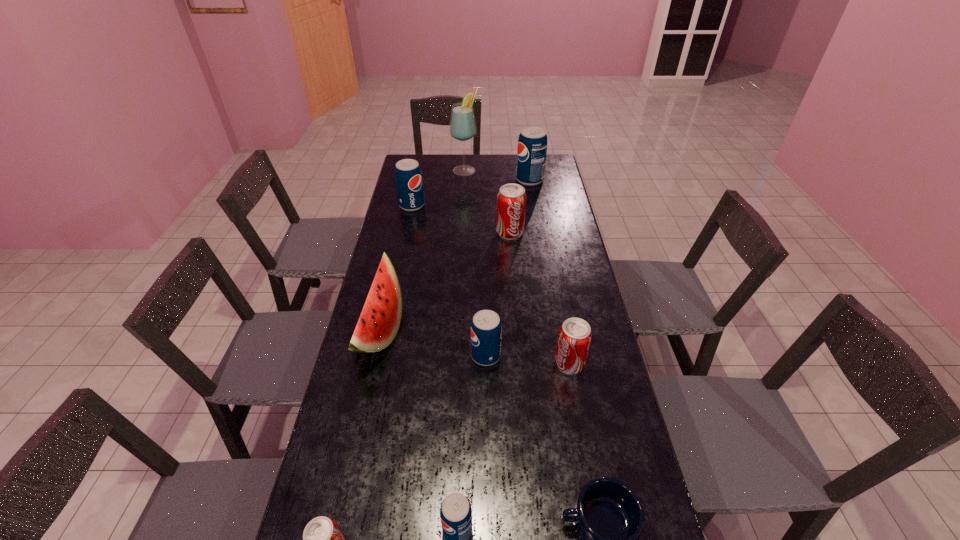
Locate an element on the screen. the sixth closest pop relative to the tallest object is located at coordinates (455, 512).

Where is `pop object that ranks as the seventh closest to the tallest object`? pop object that ranks as the seventh closest to the tallest object is located at coordinates (322, 539).

Where is `blue pop that stands as the fourth closest to the blue mug`? blue pop that stands as the fourth closest to the blue mug is located at coordinates 532,144.

Identify which blue pop is the third closest to the second nearest red soda can. Please provide its 2D coordinates. Your answer should be formatted as a tuple, i.e. [(x, y)], where the tuple contains the x and y coordinates of a point satisfying the conditions above.

[(408, 176)]

Image resolution: width=960 pixels, height=540 pixels. I want to click on the closest red soda can to the alcohol, so click(511, 200).

Point out which red soda can is positioned as the nearest to the seventh nearest object. Please provide its 2D coordinates. Your answer should be formatted as a tuple, i.e. [(x, y)], where the tuple contains the x and y coordinates of a point satisfying the conditions above.

[(574, 338)]

You are a GUI agent. You are given a task and a screenshot of the screen. Output one action in this format:
    pyautogui.click(x=<x>, y=<y>)
    Task: Click on the free location that satisfies the following two spatial constraints: 1. on the outer rind of the second smallest blue pop; 2. on the left side of the watermelon
    The width and height of the screenshot is (960, 540).
    Given the screenshot: What is the action you would take?
    pyautogui.click(x=373, y=355)